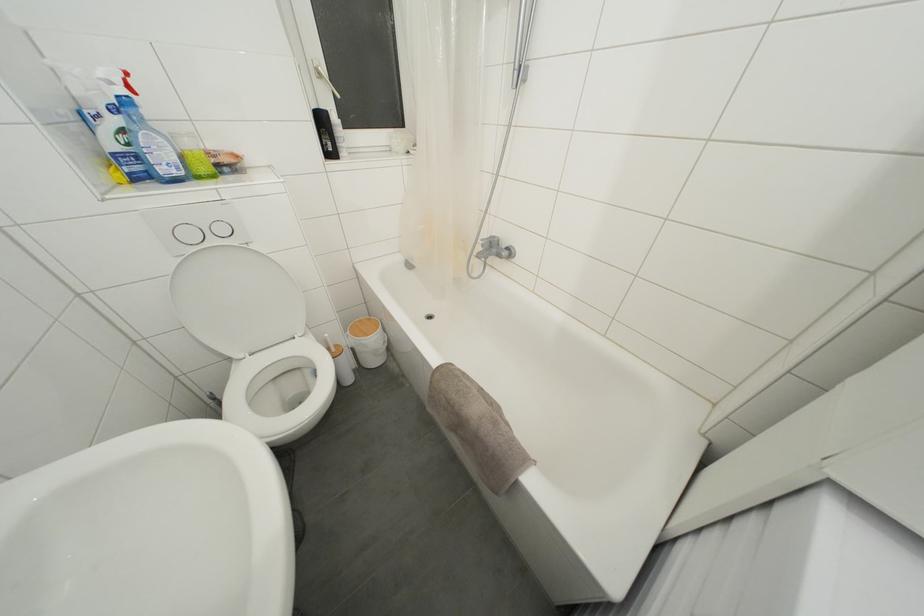
Where is `white window handle`? The image size is (924, 616). white window handle is located at coordinates (323, 78).